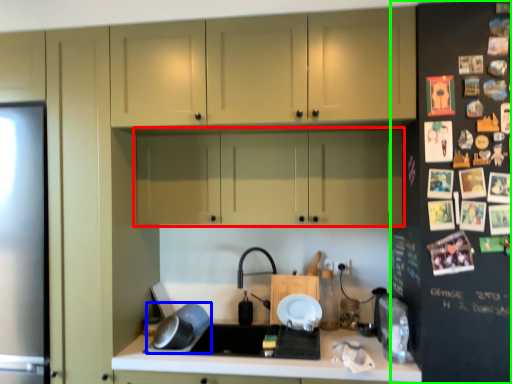
Question: Which object is positioned farthest from cabinetry (highlighted by a red box)? Select from appliance (highlighted by a blue box) and fridge (highlighted by a green box).

Choices:
 (A) appliance
 (B) fridge

Answer: (A)